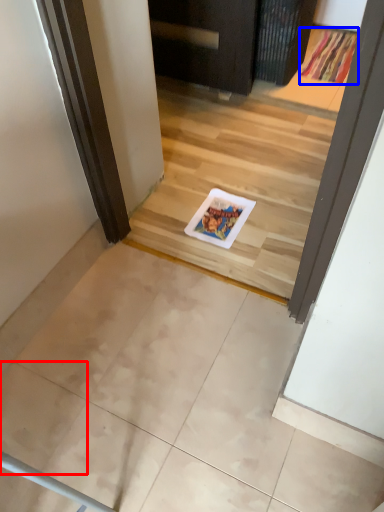
Question: Which of the following is the closest to the observer, ceramic tile (highlighted by a red box) or doormat (highlighted by a blue box)?

Choices:
 (A) ceramic tile
 (B) doormat

Answer: (A)